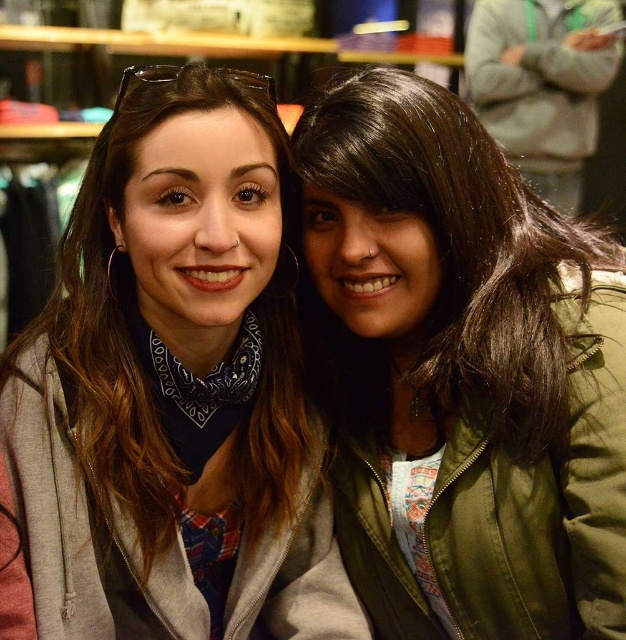
The width and height of the screenshot is (626, 640). Describe the element at coordinates (461, 372) in the screenshot. I see `green leather jacket at center` at that location.

Is green leather jacket at center taller than gray fleece jacket at upper right?

Yes, green leather jacket at center is taller than gray fleece jacket at upper right.

Locate an element on the screen. The width and height of the screenshot is (626, 640). green leather jacket at center is located at coordinates (461, 372).

Is point (593, 330) closer to camera compared to point (26, 451)?

No.

Who is taller, green leather jacket at center or gray fleece jacket at center?

Standing taller between the two is green leather jacket at center.

Who is more distant from viewer, (451, 164) or (295, 477)?

The point (295, 477) is more distant.

You are a GUI agent. You are given a task and a screenshot of the screen. Output one action in this format:
    pyautogui.click(x=<x>, y=<y>)
    Task: Click on the green leather jacket at center
    The image size is (626, 640).
    Given the screenshot: What is the action you would take?
    pyautogui.click(x=461, y=372)

Which is above, gray fleece jacket at center or gray fleece jacket at upper right?

gray fleece jacket at upper right

Describe the element at coordinates (172, 392) in the screenshot. This screenshot has width=626, height=640. I see `gray fleece jacket at center` at that location.

Image resolution: width=626 pixels, height=640 pixels. What do you see at coordinates (172, 392) in the screenshot?
I see `gray fleece jacket at center` at bounding box center [172, 392].

The height and width of the screenshot is (640, 626). Identify the location of gray fleece jacket at center. pos(172,392).